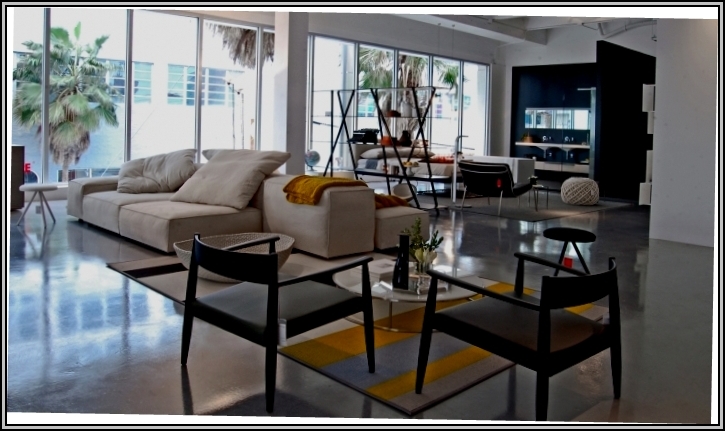
The height and width of the screenshot is (431, 725). Identify the location of sectional. click(x=483, y=160).